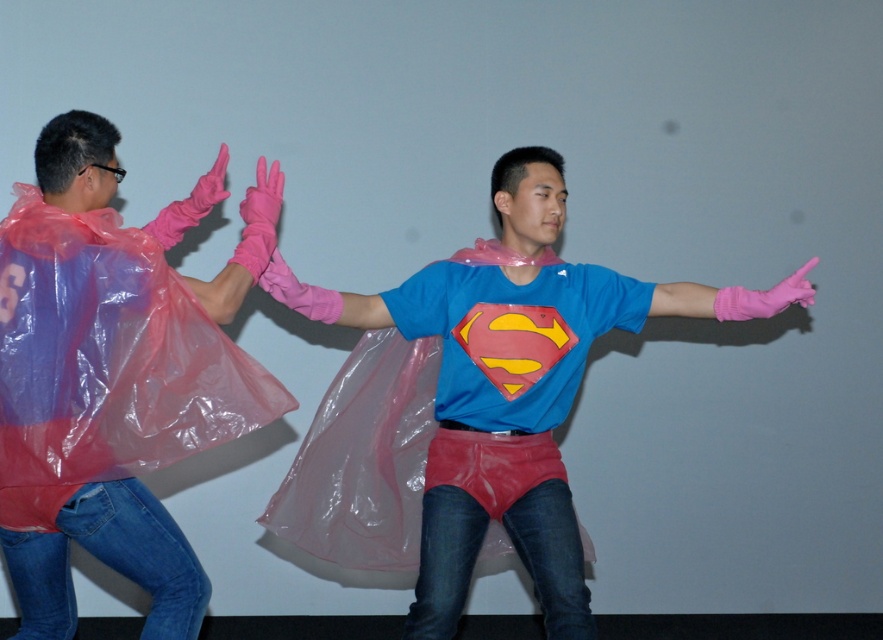
Looking at this image, you are a photographer setting up for a superhero photoshoot. You need to position a light source to highlight the transparent plastic cape at left without casting shadows on the superhero on the right. Where should you place the light relative to the cape?

The transparent plastic cape at left is located at point (114, 376). To avoid casting shadows on the superhero on the right, position the light source directly in front of the cape, ensuring the light hits it at an angle that doesn

You are a costume designer trying to decide which item to place on a mannequin first. The matte plastic superman costume at center and the blue fabric superman shirt at center are both part of the outfit. Which item should you put on the mannequin first based on their size?

The matte plastic superman costume at center is taller than the blue fabric superman shirt at center, so you should put the matte plastic superman costume at center on the mannequin first since it is larger and likely goes over the shirt.

You are a costume designer trying to fit a superhero costume for a child actor. You have two options in the image, the matte plastic superman costume at center and the blue fabric superman shirt at center. Which one is more suitable for a child who needs a smaller size?

The blue fabric superman shirt at center is more suitable for a child who needs a smaller size because the matte plastic superman costume at center is bigger than it.